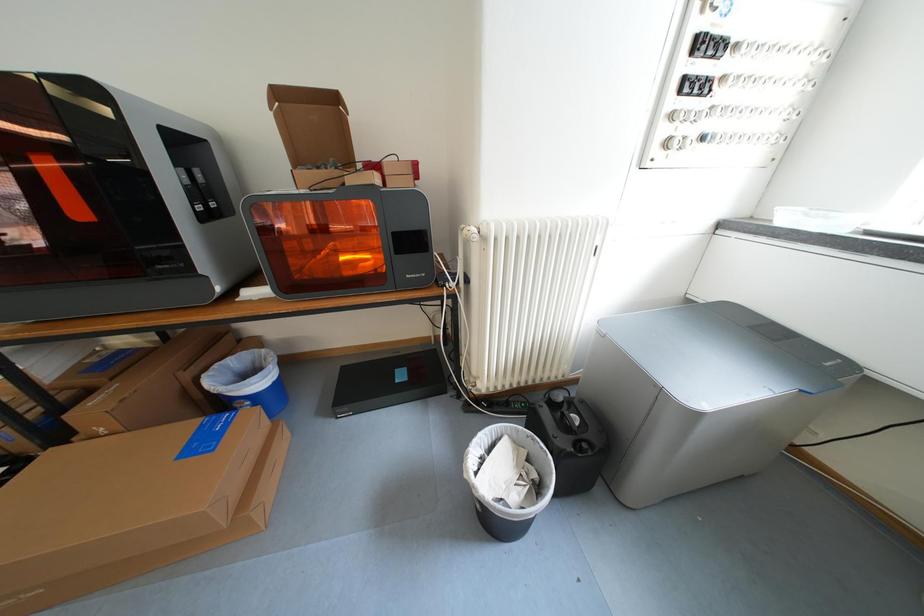
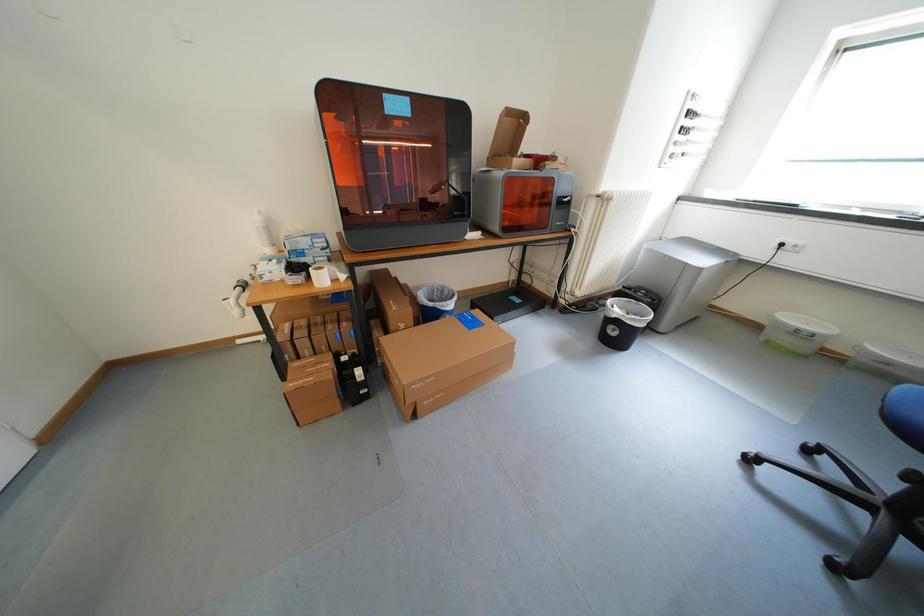
What movement of the cameraman would produce the second image?

The cameraman walked toward left, backward.